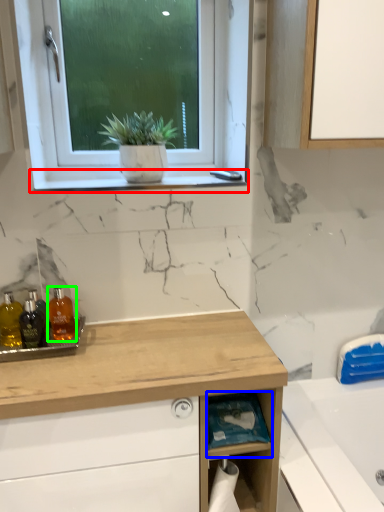
Question: Considering the real-world distances, which object is farthest from window sill (highlighted by a red box)? shelf (highlighted by a blue box) or toiletry (highlighted by a green box)?

Choices:
 (A) shelf
 (B) toiletry

Answer: (A)